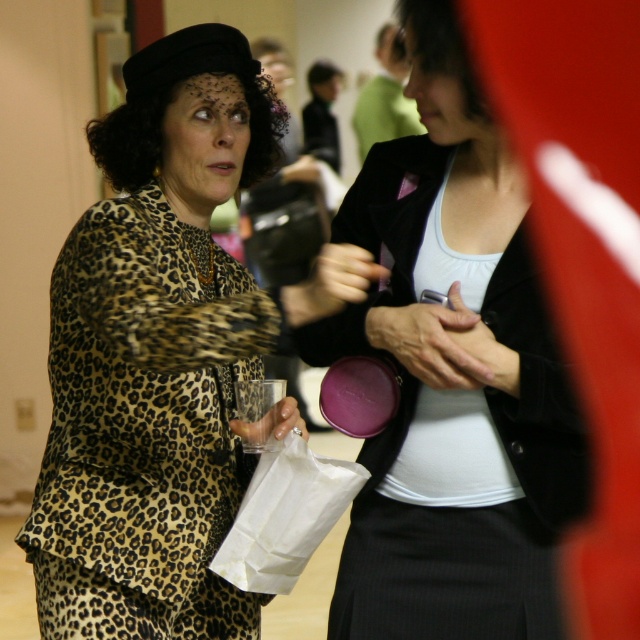
Question: Which of the following is the farthest from the observer?

Choices:
 (A) matte black blazer at center
 (B) white paper bag at lower center
 (C) leopard print dress at center

Answer: (B)

Question: Can you confirm if matte black blazer at center is wider than white paper bag at lower center?

Choices:
 (A) no
 (B) yes

Answer: (B)

Question: Which object is the farthest from the leopard print dress at center?

Choices:
 (A) white paper bag at lower center
 (B) matte black blazer at center

Answer: (B)

Question: Does leopard print dress at center appear on the left side of white paper bag at lower center?

Choices:
 (A) yes
 (B) no

Answer: (A)

Question: Does matte black blazer at center appear under white paper bag at lower center?

Choices:
 (A) no
 (B) yes

Answer: (A)

Question: Which of these objects is positioned farthest from the leopard print dress at center?

Choices:
 (A) white paper bag at lower center
 (B) matte black blazer at center

Answer: (B)